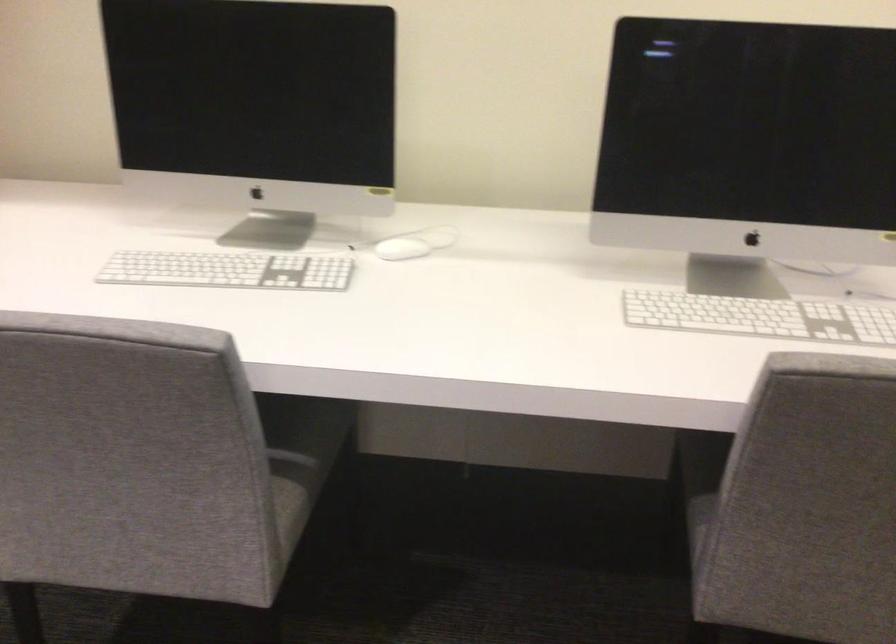
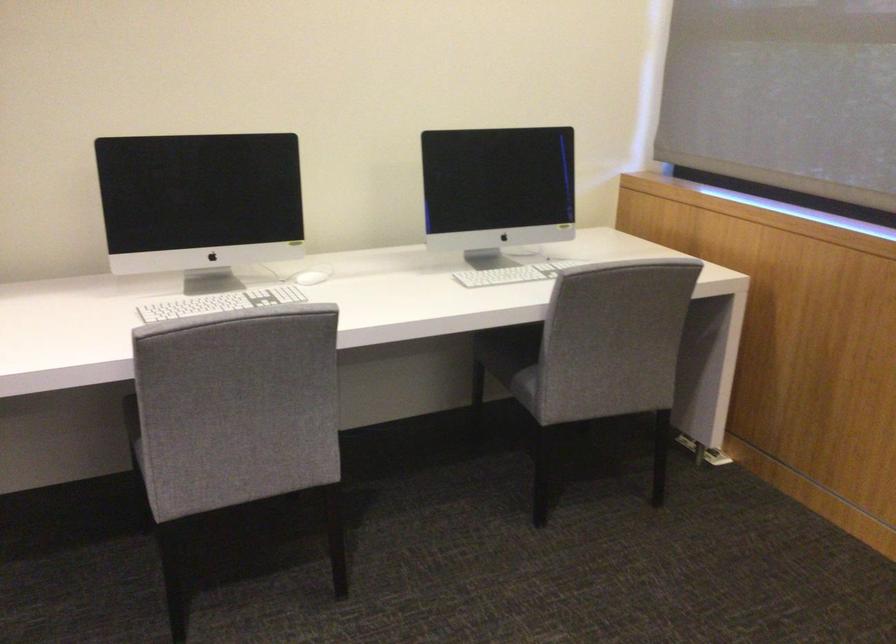
The point at (239, 269) is marked in the first image. Where is the corresponding point in the second image?

(220, 303)